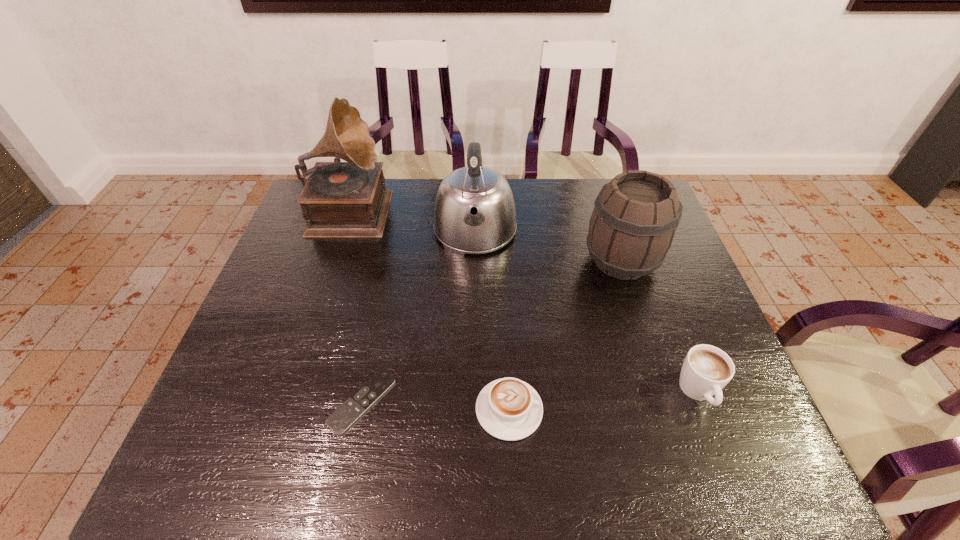
The image size is (960, 540). I want to click on vacant space located on the left of the third tallest object, so click(497, 261).

Image resolution: width=960 pixels, height=540 pixels. What are the coordinates of `vacant region located with the handle on the side of the right cappuccino` in the screenshot? It's located at (725, 463).

The width and height of the screenshot is (960, 540). What are the coordinates of `vacant space located with the handle on the right side of the left cappuccino` in the screenshot? It's located at (686, 410).

Where is `free spot located 0.080m on the front of the remote control`? free spot located 0.080m on the front of the remote control is located at coordinates (347, 477).

Image resolution: width=960 pixels, height=540 pixels. I want to click on record player that is at the far edge, so click(348, 199).

This screenshot has height=540, width=960. I want to click on kettle that is at the far edge, so click(x=474, y=213).

Identify the location of cappuccino located in the near edge section of the desktop. (509, 409).

At what (x,y) coordinates should I click in order to perform the action: click on remote control that is at the near edge. Please return your answer as a coordinate pair (x, y). Image resolution: width=960 pixels, height=540 pixels. Looking at the image, I should click on (357, 404).

Where is `object present at the left edge`? This screenshot has height=540, width=960. object present at the left edge is located at coordinates (x=348, y=199).

At what (x,y) coordinates should I click in order to perform the action: click on wine bucket that is at the right edge. Please return your answer as a coordinate pair (x, y). The width and height of the screenshot is (960, 540). Looking at the image, I should click on (632, 226).